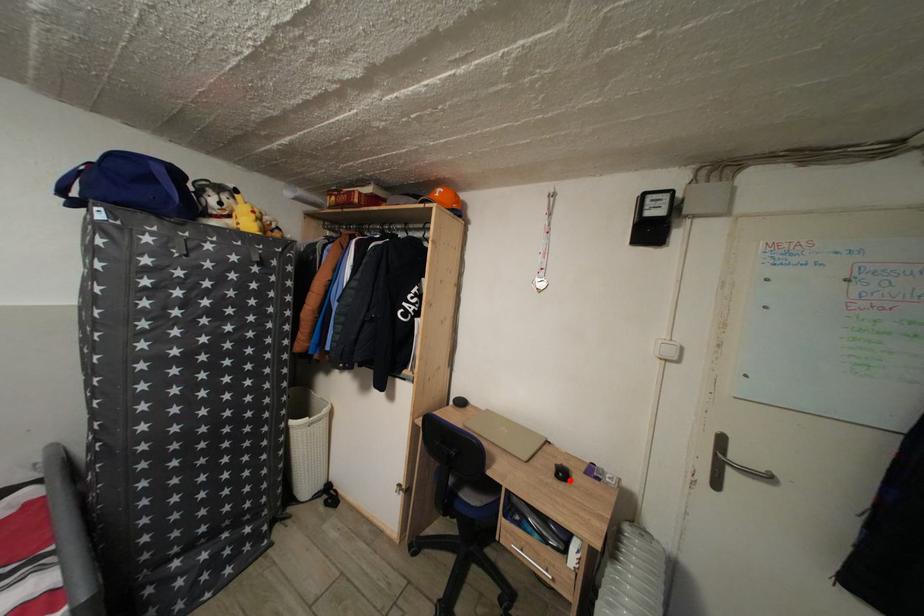
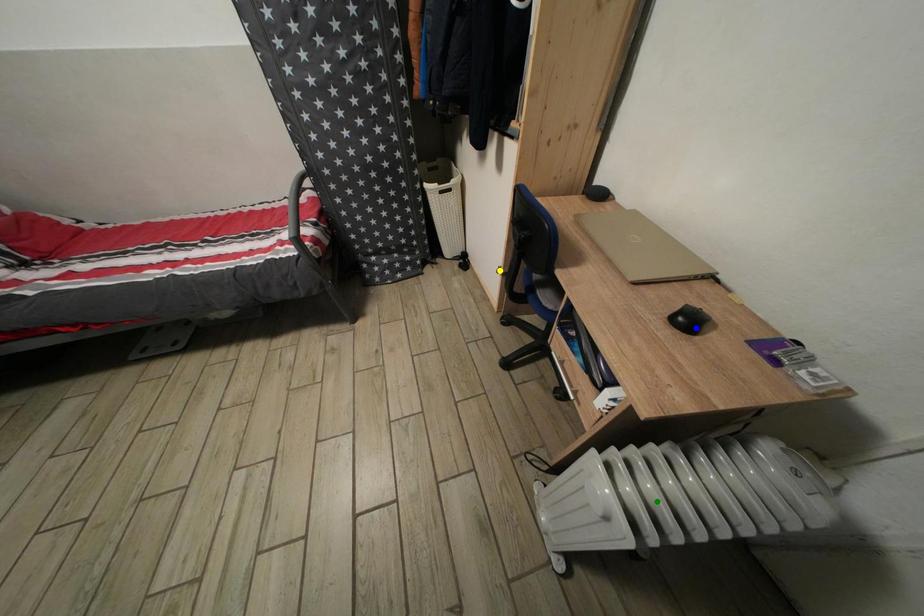
Question: I am providing you with two images of the same scene from different viewpoints. A red point is marked on the first image. You are given multiple points on the second image. Which point in image 2 represents the same 3d spot as the red point in image 1?

Choices:
 (A) green point
 (B) yellow point
 (C) blue point

Answer: (C)